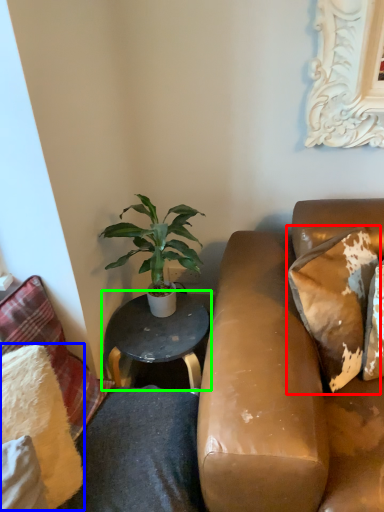
Question: Estimate the real-world distances between objects in this image. Which object is farther from pillow (highlighted by a red box), pillow (highlighted by a blue box) or table (highlighted by a green box)?

Choices:
 (A) pillow
 (B) table

Answer: (A)